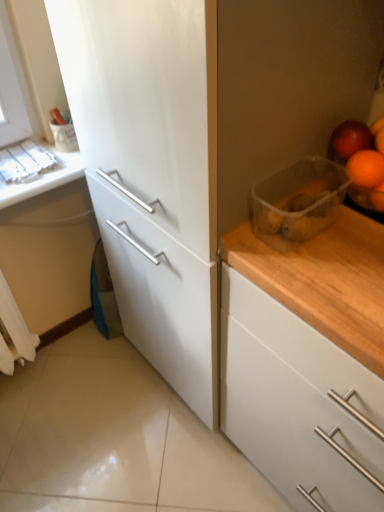
The height and width of the screenshot is (512, 384). Find the location of `free space between orange matte plastic at upper right and transparent plastic container at upper right`. free space between orange matte plastic at upper right and transparent plastic container at upper right is located at coordinates coord(344,230).